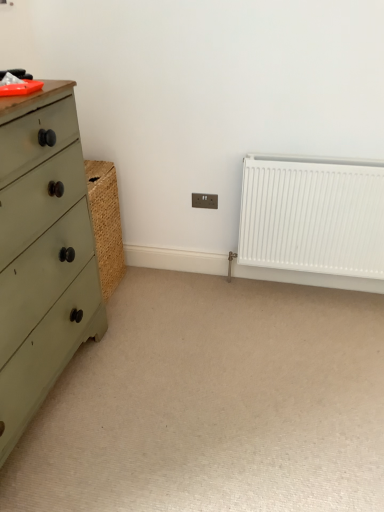
Locate an element on the screen. The image size is (384, 512). green matte chest of drawers at left is located at coordinates (42, 263).

Where is `brown plastic electric outlet at center`? brown plastic electric outlet at center is located at coordinates (204, 201).

Locate an element on the screen. This screenshot has height=512, width=384. chest of drawers located on the left of brown plastic electric outlet at center is located at coordinates (42, 263).

From the picture: Based on their positions, is brown plastic electric outlet at center located to the left or right of green matte chest of drawers at left?

Based on their positions, brown plastic electric outlet at center is located to the right of green matte chest of drawers at left.

Can you confirm if brown plastic electric outlet at center is thinner than green matte chest of drawers at left?

Yes.

Is brown plastic electric outlet at center next to green matte chest of drawers at left and touching it?

There is a gap between brown plastic electric outlet at center and green matte chest of drawers at left.

Does green matte chest of drawers at left turn towards beige carpet at center?

Yes, green matte chest of drawers at left is aimed at beige carpet at center.

Does green matte chest of drawers at left lie in front of beige carpet at center?

Yes, green matte chest of drawers at left is closer to the viewer.

Is the surface of green matte chest of drawers at left in direct contact with beige carpet at center?

They are not placed beside each other.

Consider the image. Visually, is white matte radiator at right positioned to the left or to the right of beige carpet at center?

In the image, white matte radiator at right appears on the right side of beige carpet at center.

Is white matte radiator at right positioned with its back to beige carpet at center?

No, white matte radiator at right is not facing the opposite direction of beige carpet at center.

Is white matte radiator at right not near beige carpet at center?

No, white matte radiator at right is not far away from beige carpet at center.

Considering the relative sizes of green matte chest of drawers at left and brown plastic electric outlet at center in the image provided, is green matte chest of drawers at left smaller than brown plastic electric outlet at center?

Actually, green matte chest of drawers at left might be larger than brown plastic electric outlet at center.

Which of these two, green matte chest of drawers at left or brown plastic electric outlet at center, is thinner?

With smaller width is brown plastic electric outlet at center.

From the image's perspective, would you say green matte chest of drawers at left is positioned over brown plastic electric outlet at center?

No, from the image's perspective, green matte chest of drawers at left is not above brown plastic electric outlet at center.

Would you say green matte chest of drawers at left is a long distance from brown plastic electric outlet at center?

That's right, there is a large distance between green matte chest of drawers at left and brown plastic electric outlet at center.

Find the location of a particular element. Image resolution: width=384 pixels, height=512 pixels. plain lying below the brown plastic electric outlet at center (from the image's perspective) is located at coordinates (213, 403).

In the image, is brown plastic electric outlet at center positioned in front of or behind beige carpet at center?

Clearly, brown plastic electric outlet at center is behind beige carpet at center.

Between point (214, 205) and point (161, 390), which one is positioned in front?

The point (161, 390) is in front.

Based on the photo, is beige carpet at center closer to the viewer compared to brown plastic electric outlet at center?

Yes, the depth of beige carpet at center is less than that of brown plastic electric outlet at center.

Where is `plain below the brown plastic electric outlet at center (from the image's perspective)`? This screenshot has height=512, width=384. plain below the brown plastic electric outlet at center (from the image's perspective) is located at coordinates (213, 403).

Is beige carpet at center shorter than brown plastic electric outlet at center?

Yes.

In terms of width, does beige carpet at center look wider or thinner when compared to brown plastic electric outlet at center?

Considering their sizes, beige carpet at center looks broader than brown plastic electric outlet at center.

Which object is closer to the camera, white matte radiator at right or green matte chest of drawers at left?

green matte chest of drawers at left.

Is white matte radiator at right oriented away from green matte chest of drawers at left?

No, white matte radiator at right is not facing away from green matte chest of drawers at left.

How many degrees apart are the facing directions of white matte radiator at right and green matte chest of drawers at left?

They differ by 89.4 degrees in their facing directions.

The width and height of the screenshot is (384, 512). Find the location of `chest of drawers to the left of white matte radiator at right`. chest of drawers to the left of white matte radiator at right is located at coordinates (42, 263).

At what (x,y) coordinates should I click in order to perform the action: click on electric outlet behind the green matte chest of drawers at left. Please return your answer as a coordinate pair (x, y). This screenshot has height=512, width=384. Looking at the image, I should click on (204, 201).

I want to click on the chest of drawers above the beige carpet at center (from a real-world perspective), so click(x=42, y=263).

Considering their positions, is white matte radiator at right positioned further to green matte chest of drawers at left than beige carpet at center?

white matte radiator at right lies further to green matte chest of drawers at left than the other object.

When comparing their distances from beige carpet at center, does green matte chest of drawers at left or brown plastic electric outlet at center seem further?

The object further to beige carpet at center is brown plastic electric outlet at center.

When comparing their distances from white matte radiator at right, does beige carpet at center or green matte chest of drawers at left seem further?

green matte chest of drawers at left lies further to white matte radiator at right than the other object.

When comparing their distances from beige carpet at center, does white matte radiator at right or brown plastic electric outlet at center seem further?

brown plastic electric outlet at center is further to beige carpet at center.

Based on their spatial positions, is green matte chest of drawers at left or white matte radiator at right further from beige carpet at center?

white matte radiator at right is positioned further to the anchor beige carpet at center.

From the image, which object appears to be farther from beige carpet at center, brown plastic electric outlet at center or green matte chest of drawers at left?

brown plastic electric outlet at center is further to beige carpet at center.

From the picture: When comparing their distances from brown plastic electric outlet at center, does green matte chest of drawers at left or white matte radiator at right seem further?

green matte chest of drawers at left is positioned further to the anchor brown plastic electric outlet at center.

From the image, which object appears to be farther from white matte radiator at right, green matte chest of drawers at left or beige carpet at center?

green matte chest of drawers at left is further to white matte radiator at right.

At what (x,y) coordinates should I click in order to perform the action: click on radiator located between green matte chest of drawers at left and brown plastic electric outlet at center in the depth direction. Please return your answer as a coordinate pair (x, y). Looking at the image, I should click on (313, 221).

You are a GUI agent. You are given a task and a screenshot of the screen. Output one action in this format:
    pyautogui.click(x=<x>, y=<y>)
    Task: Click on the radiator between beige carpet at center and brown plastic electric outlet at center along the z-axis
    
    Given the screenshot: What is the action you would take?
    pyautogui.click(x=313, y=221)

You are a GUI agent. You are given a task and a screenshot of the screen. Output one action in this format:
    pyautogui.click(x=<x>, y=<y>)
    Task: Click on the plain between green matte chest of drawers at left and white matte radiator at right from left to right
    The image size is (384, 512).
    Given the screenshot: What is the action you would take?
    pyautogui.click(x=213, y=403)

This screenshot has height=512, width=384. Find the location of `plain located between green matte chest of drawers at left and brown plastic electric outlet at center in the depth direction`. plain located between green matte chest of drawers at left and brown plastic electric outlet at center in the depth direction is located at coordinates (213, 403).